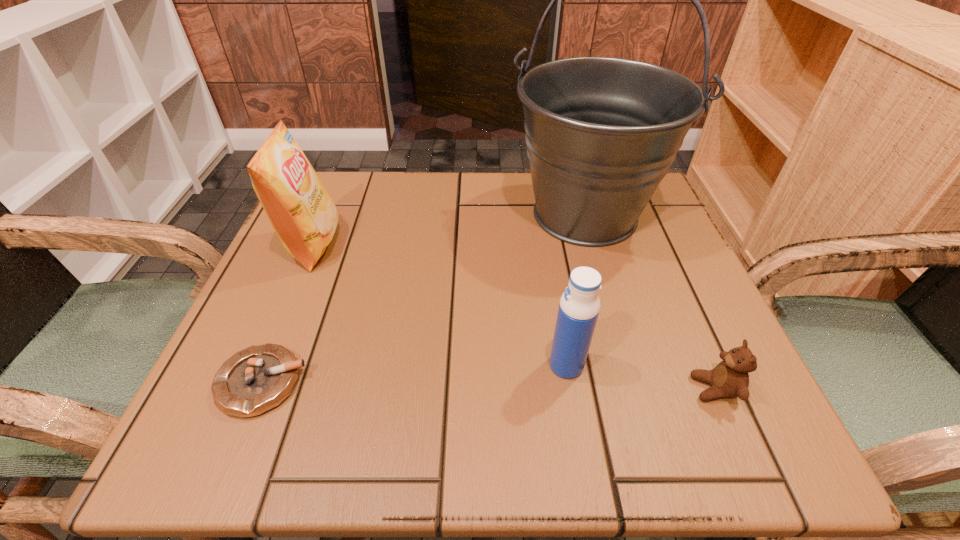
I want to click on object located at the far left corner, so click(x=299, y=208).

At what (x,y) coordinates should I click in order to perform the action: click on object that is at the near left corner. Please return your answer as a coordinate pair (x, y). The width and height of the screenshot is (960, 540). Looking at the image, I should click on (257, 379).

Identify the location of object located at the far right corner. Image resolution: width=960 pixels, height=540 pixels. (601, 133).

What are the coordinates of `object at the near right corner` in the screenshot? It's located at (729, 379).

I want to click on vacant area at the far edge of the desktop, so click(x=499, y=184).

Locate an element on the screen. The width and height of the screenshot is (960, 540). vacant space at the near edge is located at coordinates (578, 443).

In the image, there is a desktop. Where is `vacant region at the left edge`? This screenshot has height=540, width=960. vacant region at the left edge is located at coordinates (276, 343).

The height and width of the screenshot is (540, 960). Identify the location of vacant space at the right edge of the desktop. point(711,358).

Locate an element on the screen. The image size is (960, 540). free spot at the far left corner of the desktop is located at coordinates (342, 195).

This screenshot has height=540, width=960. I want to click on free space at the far right corner, so click(x=648, y=218).